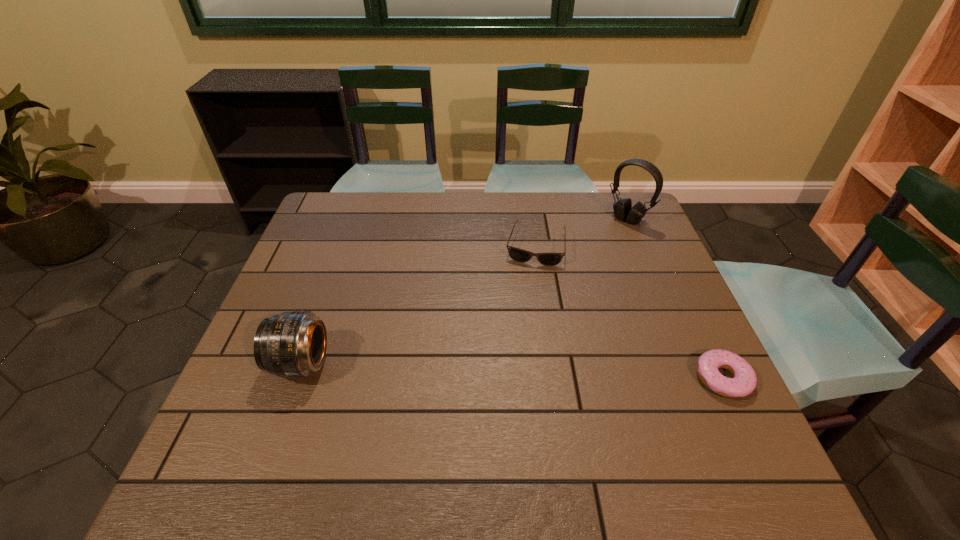
The height and width of the screenshot is (540, 960). I want to click on headset located at the right edge, so click(x=623, y=210).

Where is `object present at the far right corner`? The height and width of the screenshot is (540, 960). object present at the far right corner is located at coordinates (623, 210).

Where is `object that is at the near right corner`? The width and height of the screenshot is (960, 540). object that is at the near right corner is located at coordinates (744, 382).

This screenshot has height=540, width=960. I want to click on blank space at the far edge, so click(x=435, y=198).

Find the location of `vacant space at the near edge of the desktop`. vacant space at the near edge of the desktop is located at coordinates (551, 412).

Where is `vacant point at the left edge`? vacant point at the left edge is located at coordinates (282, 388).

The height and width of the screenshot is (540, 960). What are the coordinates of `vacant area at the right edge` in the screenshot? It's located at (668, 285).

In the image, there is a desktop. Where is `vacant region at the far left corner`? The height and width of the screenshot is (540, 960). vacant region at the far left corner is located at coordinates (361, 195).

Locate an element on the screen. The height and width of the screenshot is (540, 960). vacant region at the far right corner of the desktop is located at coordinates (596, 197).

At what (x,y) coordinates should I click in order to perform the action: click on free space between the tallest object and the third object from right to left. Please return your answer as a coordinate pair (x, y). The width and height of the screenshot is (960, 540). Looking at the image, I should click on (582, 233).